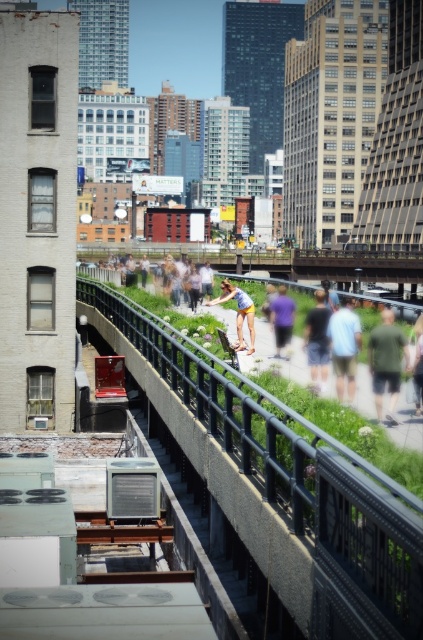
Is green grass at center taller than dark gray shorts at center?

Correct, green grass at center is much taller as dark gray shorts at center.

Does green grass at center come behind dark gray shorts at center?

Yes, it is.

Is point (404, 269) in front of point (324, 376)?

No, it is behind (324, 376).

The height and width of the screenshot is (640, 423). I want to click on green grass at center, so click(321, 264).

Is dark gray shorts at center behind purple cotton shirt at center?

No, dark gray shorts at center is in front of purple cotton shirt at center.

Between point (320, 381) and point (271, 323), which one is positioned in front?

Point (320, 381) is more forward.

Locate an element on the screen. dark gray shorts at center is located at coordinates (318, 340).

What do you see at coordinates (296, 481) in the screenshot? The height and width of the screenshot is (640, 423). I see `black metal rail at center` at bounding box center [296, 481].

Can you confirm if black metal rail at center is bigger than green grass at center?

No.

What do you see at coordinates (296, 481) in the screenshot? The width and height of the screenshot is (423, 640). I see `black metal rail at center` at bounding box center [296, 481].

Find the location of a particular element. The height and width of the screenshot is (640, 423). black metal rail at center is located at coordinates (296, 481).